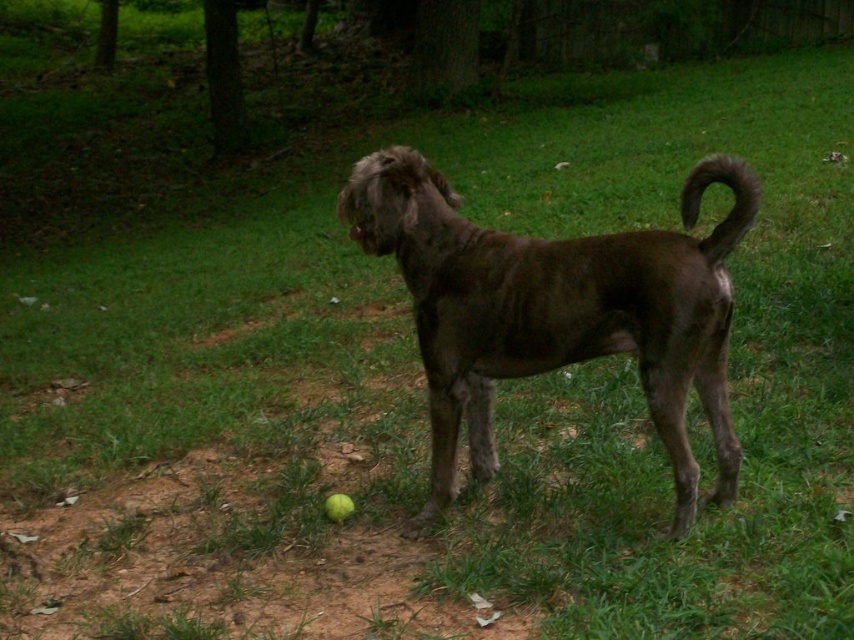
What is located at the coordinates point (556,308) in the image?

The coordinates point (556,308) corresponds to shiny brown fur at center.